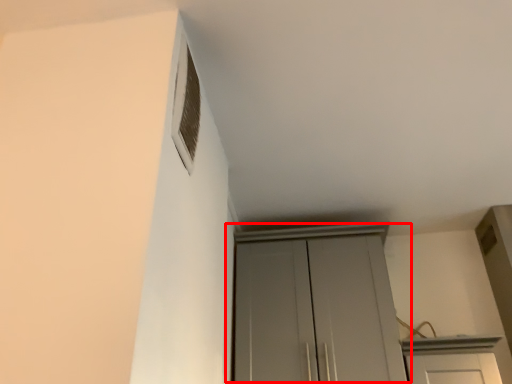
Question: From the image's perspective, what is the correct spatial relationship of cupboard (annotated by the red box) in relation to window?

Choices:
 (A) below
 (B) above

Answer: (A)